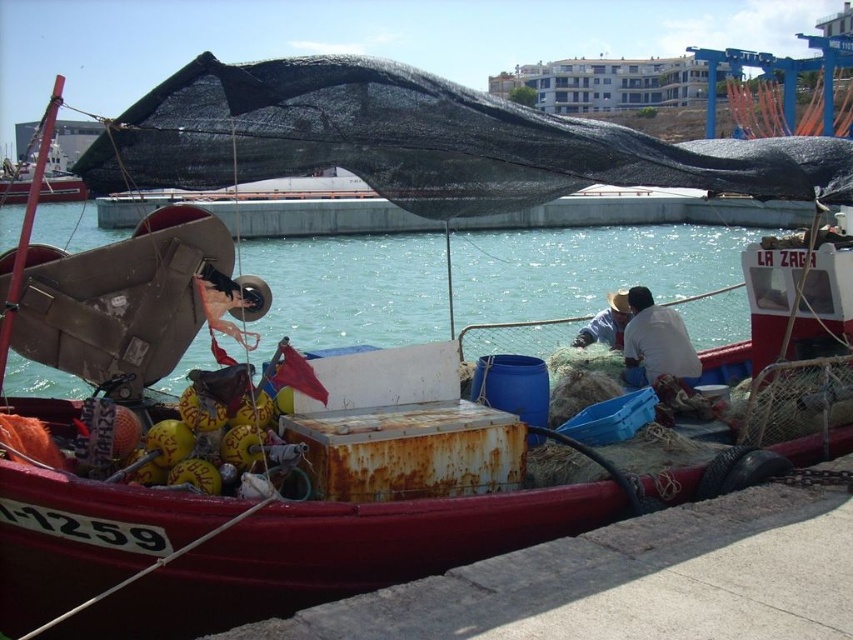
Question: Which object is farther from the camera taking this photo?

Choices:
 (A) clear blue water at center
 (B) white straw hat at center
 (C) white matte shirt at center

Answer: (B)

Question: Which of the following is the farthest from the observer?

Choices:
 (A) white straw hat at center
 (B) clear blue water at center

Answer: (A)

Question: Can you confirm if white matte shirt at center is smaller than white straw hat at center?

Choices:
 (A) no
 (B) yes

Answer: (A)

Question: Does clear blue water at center have a lesser width compared to white matte shirt at center?

Choices:
 (A) no
 (B) yes

Answer: (A)

Question: From the image, what is the correct spatial relationship of white matte shirt at center in relation to white straw hat at center?

Choices:
 (A) right
 (B) left

Answer: (A)

Question: Considering the real-world distances, which object is farthest from the white matte shirt at center?

Choices:
 (A) white straw hat at center
 (B) clear blue water at center

Answer: (B)